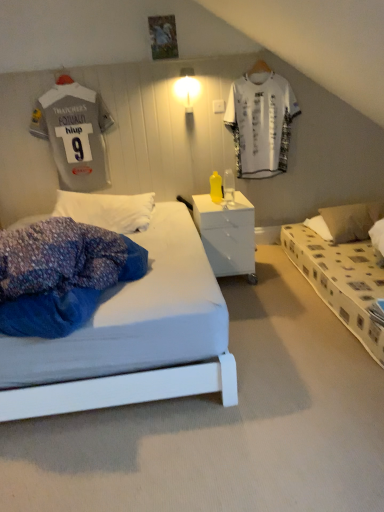
Question: Considering the relative sizes of brown fabric pillow at right and white glossy light fixture at upper center in the image provided, is brown fabric pillow at right smaller than white glossy light fixture at upper center?

Choices:
 (A) no
 (B) yes

Answer: (A)

Question: From the image's perspective, is brown fabric pillow at right located beneath white glossy light fixture at upper center?

Choices:
 (A) yes
 (B) no

Answer: (A)

Question: Is brown fabric pillow at right further to camera compared to white glossy light fixture at upper center?

Choices:
 (A) yes
 (B) no

Answer: (A)

Question: Is white glossy light fixture at upper center a part of brown fabric pillow at right?

Choices:
 (A) yes
 (B) no

Answer: (B)

Question: Is brown fabric pillow at right thinner than white glossy light fixture at upper center?

Choices:
 (A) yes
 (B) no

Answer: (B)

Question: From the image's perspective, is yellow plastic bottle at center located above or below brown fabric pillow at right?

Choices:
 (A) below
 (B) above

Answer: (B)

Question: From a real-world perspective, relative to brown fabric pillow at right, is yellow plastic bottle at center vertically above or below?

Choices:
 (A) above
 (B) below

Answer: (A)

Question: In terms of size, does yellow plastic bottle at center appear bigger or smaller than brown fabric pillow at right?

Choices:
 (A) big
 (B) small

Answer: (B)

Question: Is yellow plastic bottle at center inside the boundaries of brown fabric pillow at right, or outside?

Choices:
 (A) outside
 (B) inside

Answer: (A)

Question: From the image's perspective, is yellow plastic bottle at center positioned above or below gray jersey at upper left, which appears as the 2th t shirt when viewed from the right?

Choices:
 (A) below
 (B) above

Answer: (A)

Question: Looking at their shapes, would you say yellow plastic bottle at center is wider or thinner than gray jersey at upper left, which appears as the 2th t shirt when viewed from the right?

Choices:
 (A) wide
 (B) thin

Answer: (A)

Question: Considering their positions, is yellow plastic bottle at center located in front of or behind gray jersey at upper left, arranged as the 1th t shirt when viewed from the left?

Choices:
 (A) front
 (B) behind

Answer: (A)

Question: In terms of height, does yellow plastic bottle at center look taller or shorter compared to gray jersey at upper left, arranged as the 1th t shirt when viewed from the left?

Choices:
 (A) short
 (B) tall

Answer: (A)

Question: Considering the positions of white printed t-shirt at upper center, the 2th t shirt positioned from the left, and white glossy light fixture at upper center in the image, is white printed t-shirt at upper center, the 2th t shirt positioned from the left, taller or shorter than white glossy light fixture at upper center?

Choices:
 (A) tall
 (B) short

Answer: (A)

Question: Is white printed t-shirt at upper center, which is counted as the 1th t shirt, starting from the right, wider or thinner than white glossy light fixture at upper center?

Choices:
 (A) thin
 (B) wide

Answer: (A)